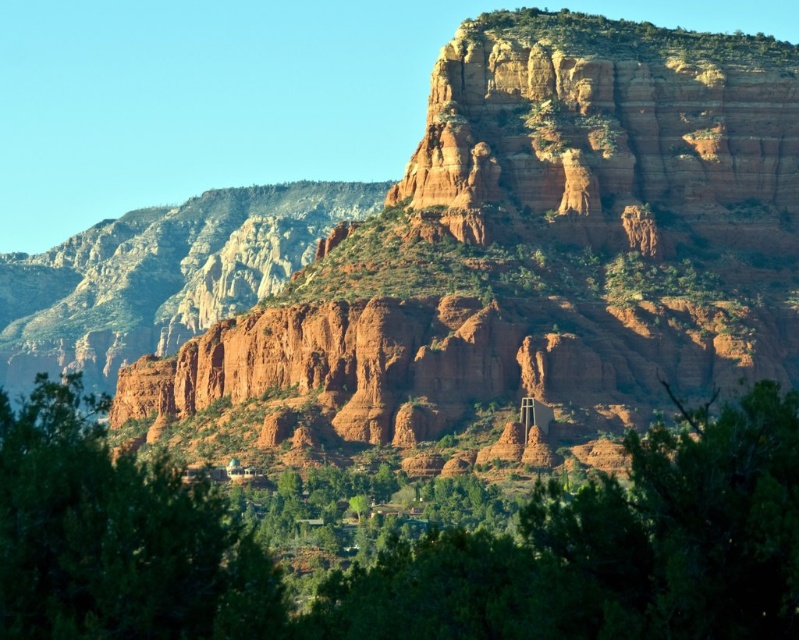
You are standing at the base of the large red rock formation and see the green leafy tree at center and the green leafy tree at lower left. Which tree is positioned to the right when facing the rock formation?

The green leafy tree at center is positioned to the right of the green leafy tree at lower left when facing the rock formation.

Based on the scene description, can you determine if the rustic rock formation at center is wider than the green leafy tree at lower left?

The rustic rock formation at center is wider than the green leafy tree at lower left according to the description.

You are standing at the base of the rustic rock formation at center and want to take a photo of it. If your camera can focus on objects up to 100 meters away, will you be able to capture the entire formation clearly?

The rustic rock formation at center is 150.05 meters away from viewer, which exceeds the camera maximum focus range of 100 meters. Therefore, you won stand close enough to capture the entire formation clearly.